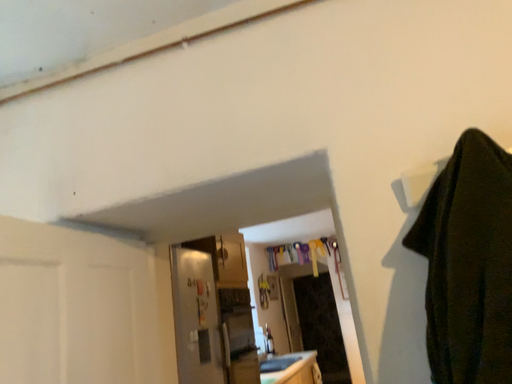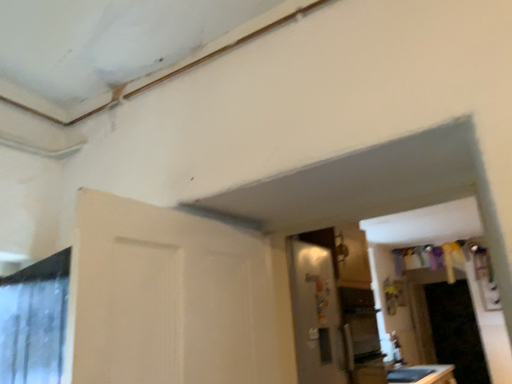
Question: How did the camera likely rotate when shooting the video?

Choices:
 (A) rotated left
 (B) rotated right

Answer: (A)